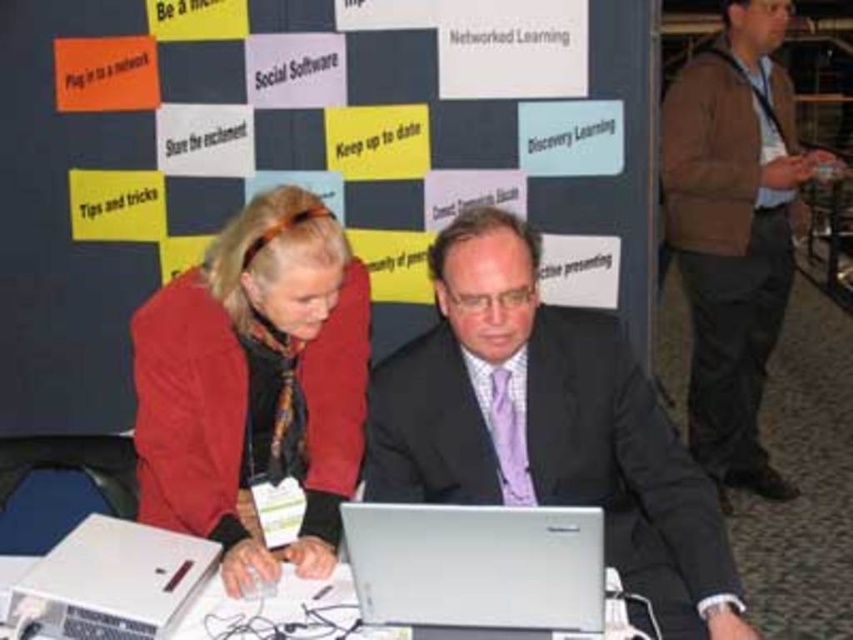
Between matte black suit at center and matte red jacket at center, which one appears on the left side from the viewer's perspective?

matte red jacket at center

Which is above, matte black suit at center or matte red jacket at center?

matte red jacket at center is higher up.

Between point (466, 340) and point (345, 292), which one is positioned in front?

Point (466, 340)

Image resolution: width=853 pixels, height=640 pixels. I want to click on matte black suit at center, so click(x=547, y=426).

Is the position of matte black board at center more distant than that of matte red jacket at center?

Yes, it is behind matte red jacket at center.

Is matte black board at center to the right of matte red jacket at center from the viewer's perspective?

Incorrect, matte black board at center is not on the right side of matte red jacket at center.

Does point (334, 125) come in front of point (173, 372)?

No.

This screenshot has height=640, width=853. Find the location of `matte black board at center`. matte black board at center is located at coordinates (303, 157).

Where is `white plastic laptop at lower left`? white plastic laptop at lower left is located at coordinates (112, 580).

Which is in front, point (165, 596) or point (613, 632)?

Point (613, 632) is in front.

Locate an element on the screen. white plastic laptop at lower left is located at coordinates click(112, 580).